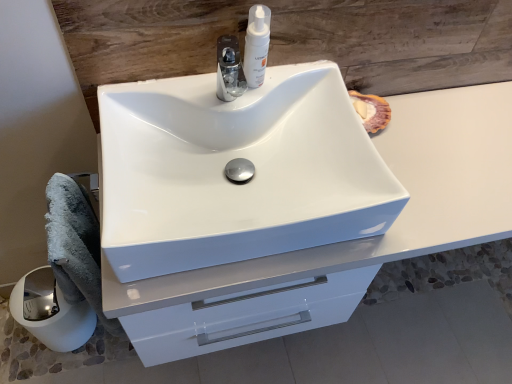
This screenshot has height=384, width=512. What are the coordinates of `free space underneath gray fluffy bath towel at lower left (from a real-world perspective)` in the screenshot? It's located at (110, 344).